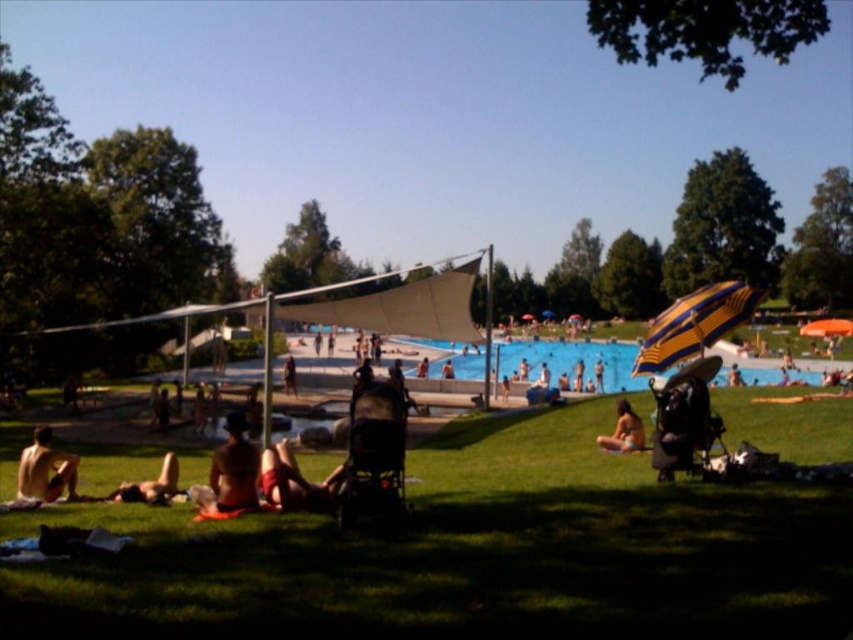
You are a person standing at the edge of the pool. You want to walk to the green grass at lower center without stepping on the skinny white man at lower left. Is there enough space between them for you to walk safely?

The green grass at lower center might be wider than the skinny white man at lower left, so there could be enough space to walk around him safely.

You are a visitor at the pool area and want to get some shade. You see a yellow striped umbrella at upper right and a skinny white man at lower left. Which object can provide shade for you?

The yellow striped umbrella at upper right can provide shade, as the skinny white man at lower left is behind it, indicating that the umbrella is casting a shadow over him.